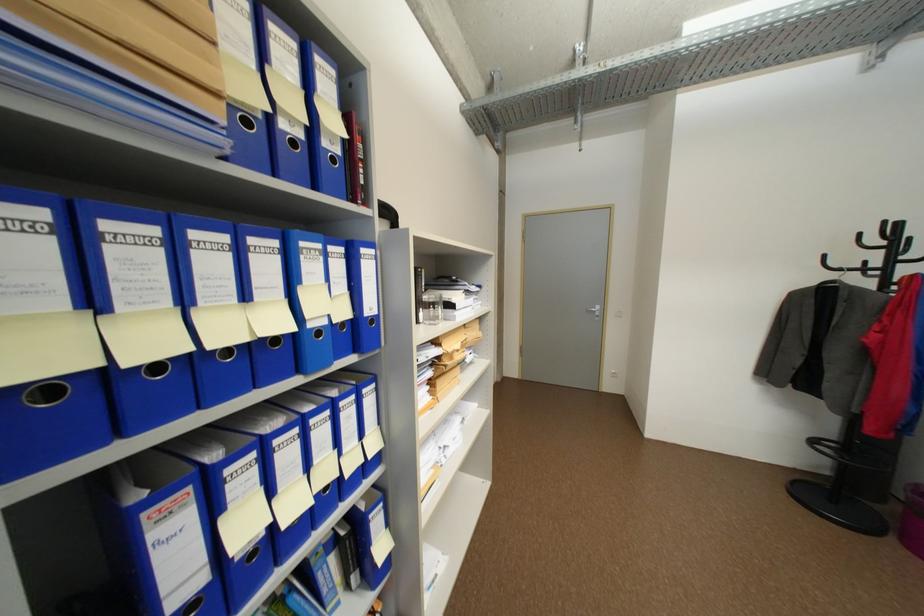
Where is `silver door handle`? The width and height of the screenshot is (924, 616). silver door handle is located at coordinates (596, 310).